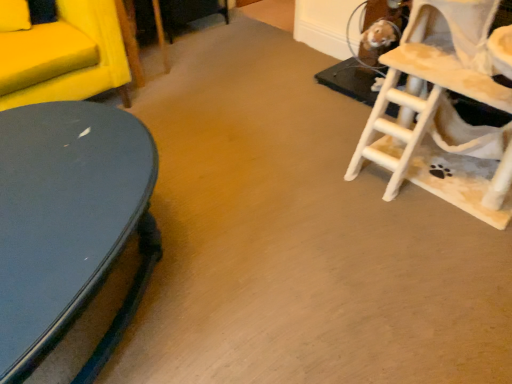
Find the location of a particular element. blank space to the left of white wooden ladder at right is located at coordinates (296, 190).